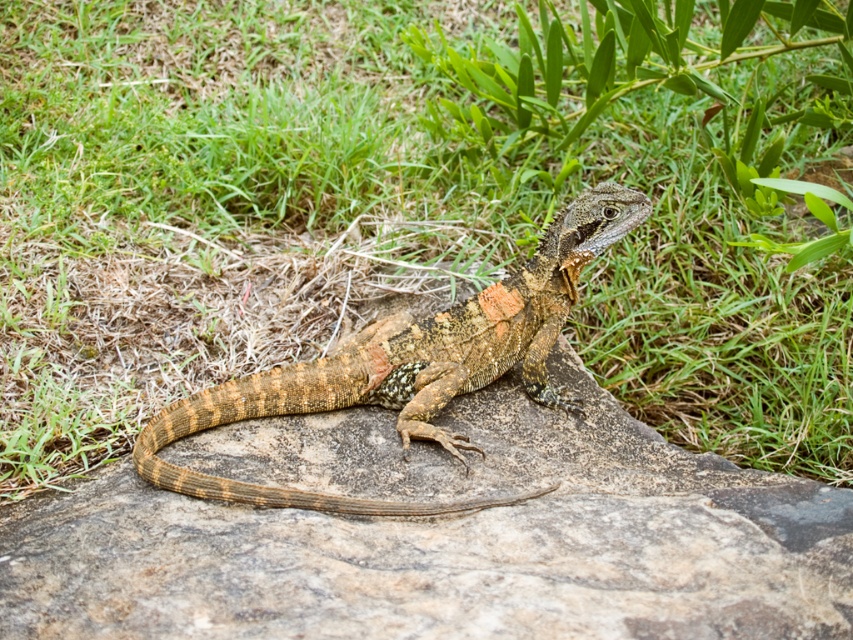
You are a nature photographer aiming to capture the speckled brown lizard at center on the brown rough stone at center. Since the lizard is smaller than the stone, which object should you focus on first to ensure both are in frame?

The brown rough stone at center is larger in width than the speckled brown lizard at center, so you should focus on the brown rough stone at center first to ensure the entire lizard fits within the frame.

You are a hiker who wants to take a photo of the speckled brown lizard at center without disturbing it. Since the lizard is on the brown rough stone at center, which object should you focus on to ensure the lizard is in the frame?

The brown rough stone at center is below the speckled brown lizard at center, so focusing on the brown rough stone at center will ensure the lizard is in the frame.

You are a small animal trying to jump from the lizard to the brown rough stone at center. Can you make the jump if your maximum jump distance is 1.5 meters?

The distance between the lizard and the brown rough stone at center is 1.54 meters, so the jump is slightly beyond your maximum capability of 1.5 meters. You might not make it successfully.